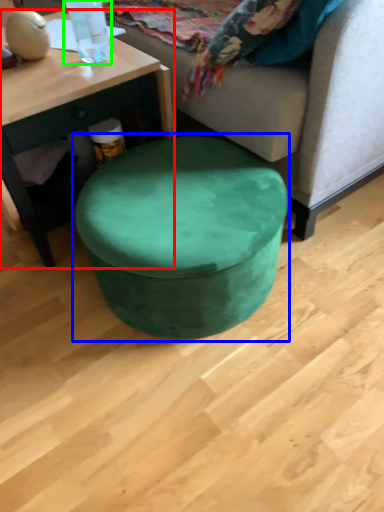
Question: Estimate the real-world distances between objects in this image. Which object is farther from coffee table (highlighted by a red box), music stool (highlighted by a blue box) or bottle (highlighted by a green box)?

Choices:
 (A) music stool
 (B) bottle

Answer: (A)